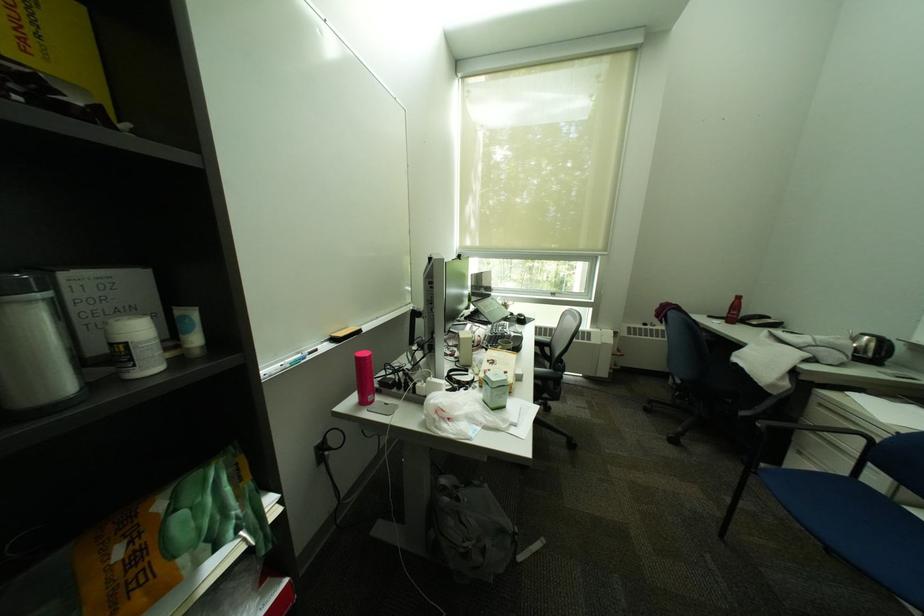
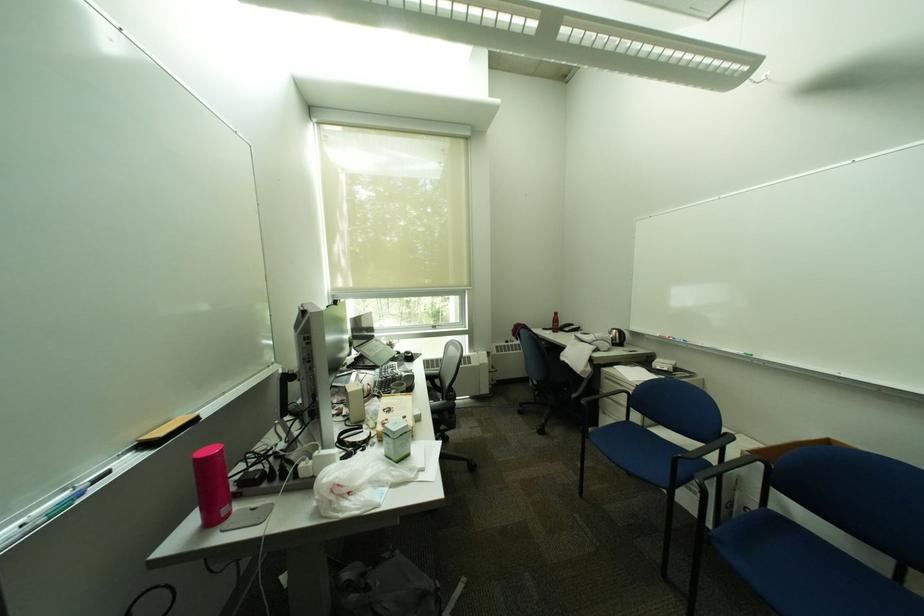
Find the pixel in the second image that matches the point at 874,482 in the first image.

(641, 421)